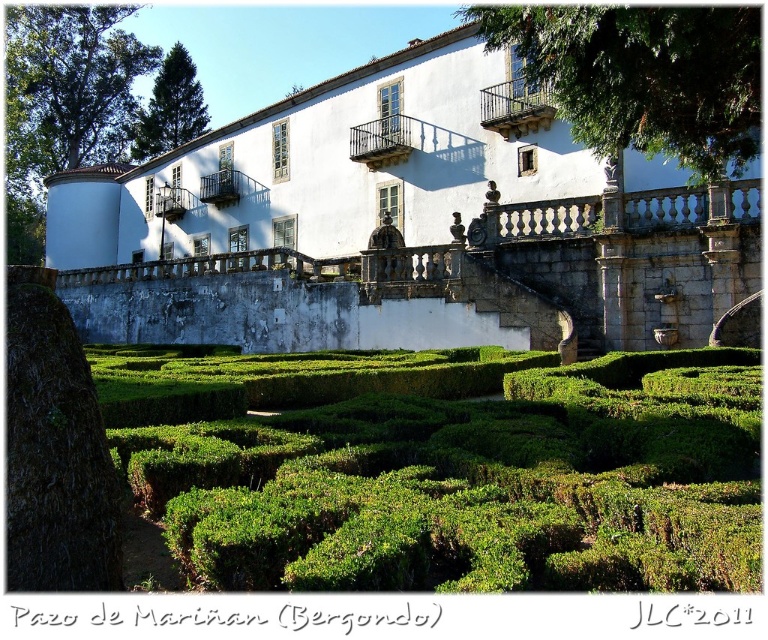
Question: Does white stone building at center lie behind green hedge at center?

Choices:
 (A) no
 (B) yes

Answer: (B)

Question: Estimate the real-world distances between objects in this image. Which object is closer to the green leafy tree at upper left?

Choices:
 (A) green hedge at center
 (B) white stone building at center

Answer: (B)

Question: Does white stone building at center lie behind green leafy tree at upper left?

Choices:
 (A) no
 (B) yes

Answer: (A)

Question: Which object is positioned farthest from the green leafy tree at upper left?

Choices:
 (A) green hedge at center
 (B) white stone building at center

Answer: (A)

Question: Can you confirm if green hedge at center is wider than green leafy tree at upper left?

Choices:
 (A) yes
 (B) no

Answer: (A)

Question: Which point is farther from the camera taking this photo?

Choices:
 (A) (343, 355)
 (B) (147, 116)
 (C) (263, 330)

Answer: (B)